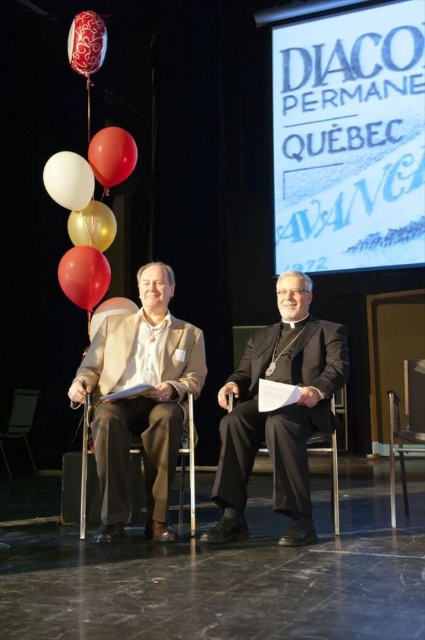
Based on the coordinates provided, which object is located at point (405, 426) in the image?

The point (405, 426) corresponds to the metallic silver chair at right.

You are organizing a stage setup for an event and need to place a metallic silver chair at right and a rubberized red balloon at center. Based on the scene description, which object occupies more space in the image?

The metallic silver chair at right is larger in size than the rubberized red balloon at center, so the metallic silver chair at right occupies more space in the image.